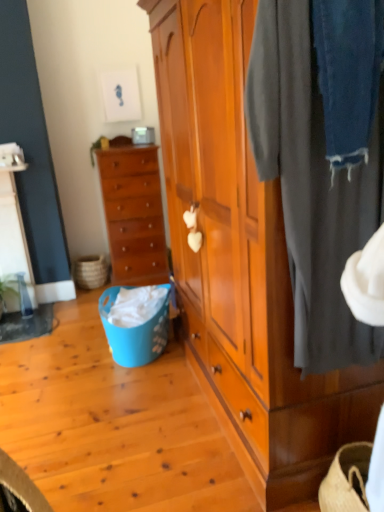
Question: Does wooden chest of drawers at center left appear on the right side of blue plastic picnic basket at lower left, the second picnic basket from the back?

Choices:
 (A) yes
 (B) no

Answer: (B)

Question: Is wooden chest of drawers at center left touching blue plastic picnic basket at lower left, which ranks as the 2th picnic basket in left-to-right order?

Choices:
 (A) yes
 (B) no

Answer: (B)

Question: Is wooden chest of drawers at center left far from blue plastic picnic basket at lower left, the 1th picnic basket viewed from the front?

Choices:
 (A) no
 (B) yes

Answer: (A)

Question: Does wooden chest of drawers at center left come in front of blue plastic picnic basket at lower left, the 1th picnic basket viewed from the front?

Choices:
 (A) no
 (B) yes

Answer: (A)

Question: Is wooden chest of drawers at center left wider than blue plastic picnic basket at lower left, which appears as the first picnic basket when viewed from the right?

Choices:
 (A) no
 (B) yes

Answer: (A)

Question: From a real-world perspective, is wooden chest of drawers at center left on top of blue plastic picnic basket at lower left, which ranks as the 2th picnic basket in left-to-right order?

Choices:
 (A) no
 (B) yes

Answer: (B)

Question: Is natural woven picnic basket at lower left, the first picnic basket from the left, looking in the opposite direction of wooden wardrobe at center?

Choices:
 (A) no
 (B) yes

Answer: (A)

Question: Is natural woven picnic basket at lower left, which is the 1th picnic basket in back-to-front order, oriented towards wooden wardrobe at center?

Choices:
 (A) yes
 (B) no

Answer: (B)

Question: From the image's perspective, is natural woven picnic basket at lower left, which is the 1th picnic basket in back-to-front order, on wooden wardrobe at center?

Choices:
 (A) yes
 (B) no

Answer: (B)

Question: Is natural woven picnic basket at lower left, the first picnic basket from the left, to the right of wooden wardrobe at center from the viewer's perspective?

Choices:
 (A) yes
 (B) no

Answer: (B)

Question: Can you confirm if natural woven picnic basket at lower left, which is counted as the second picnic basket, starting from the right, is taller than wooden wardrobe at center?

Choices:
 (A) no
 (B) yes

Answer: (A)

Question: Does natural woven picnic basket at lower left, which is the second picnic basket in front-to-back order, lie behind wooden wardrobe at center?

Choices:
 (A) no
 (B) yes

Answer: (B)

Question: Considering the relative sizes of dark gray fabric at right and wooden chest of drawers at center left in the image provided, is dark gray fabric at right bigger than wooden chest of drawers at center left?

Choices:
 (A) yes
 (B) no

Answer: (B)